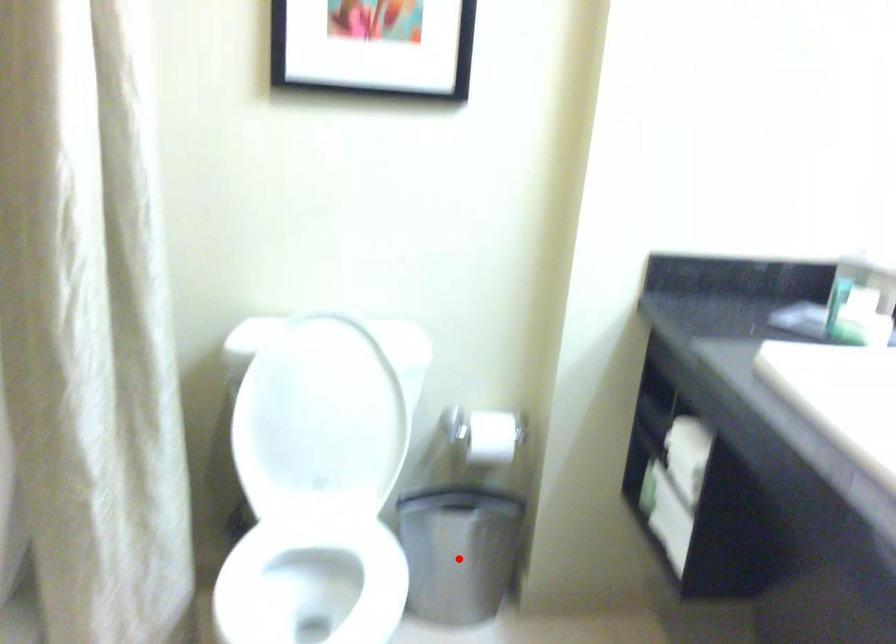
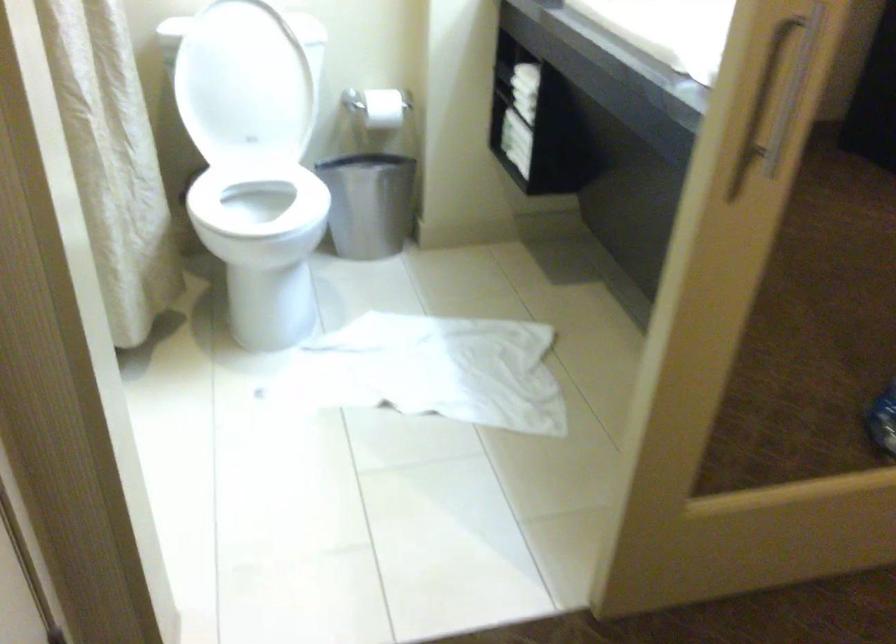
Find the pixel in the second image that matches the highlighted location in the first image.

(367, 204)